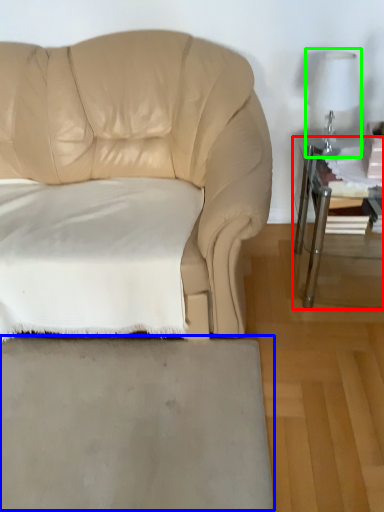
Question: Considering the real-world distances, which object is closest to table (highlighted by a red box)? concrete (highlighted by a blue box) or table lamp (highlighted by a green box).

Choices:
 (A) concrete
 (B) table lamp

Answer: (B)